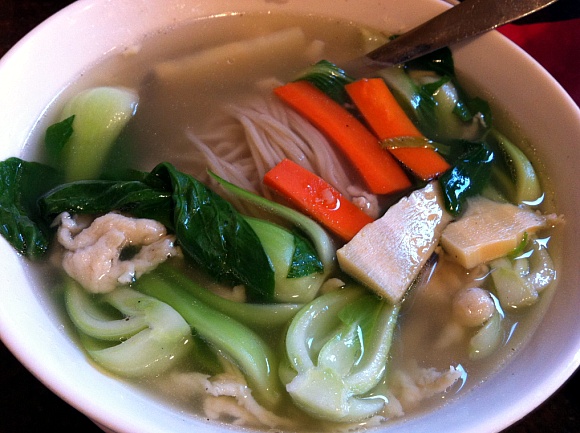
Image resolution: width=580 pixels, height=433 pixels. What are the coordinates of `bowl` in the screenshot? It's located at (514, 401).